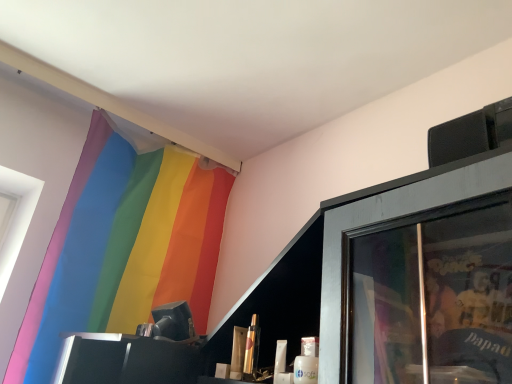
The image size is (512, 384). Find the location of `metallic gold lipstick at center, the 2th toiletry in the left-to-right sequence`. metallic gold lipstick at center, the 2th toiletry in the left-to-right sequence is located at coordinates (251, 350).

Based on their sizes in the image, would you say rainbow fabric curtain at upper left is bigger or smaller than metallic gold lipstick at center, positioned as the second toiletry in right-to-left order?

In the image, rainbow fabric curtain at upper left appears to be larger than metallic gold lipstick at center, positioned as the second toiletry in right-to-left order.

In the scene shown: Is rainbow fabric curtain at upper left completely or partially outside of metallic gold lipstick at center, positioned as the second toiletry in right-to-left order?

Yes, rainbow fabric curtain at upper left is located beyond the bounds of metallic gold lipstick at center, positioned as the second toiletry in right-to-left order.

Is rainbow fabric curtain at upper left placed right next to metallic gold lipstick at center, the 1th toiletry in the left-to-right sequence?

No, rainbow fabric curtain at upper left is not beside metallic gold lipstick at center, the 1th toiletry in the left-to-right sequence.

You are a GUI agent. You are given a task and a screenshot of the screen. Output one action in this format:
    pyautogui.click(x=<x>, y=<y>)
    Task: Click on the curtain above the metallic gold lipstick at center, positioned as the second toiletry in right-to-left order (from the image's perspective)
    The height and width of the screenshot is (384, 512).
    Given the screenshot: What is the action you would take?
    pos(124,246)

Which object is positioned more to the left, metallic gold lipstick at center, the 1th toiletry in the left-to-right sequence, or rainbow fabric curtain at upper left?

Positioned to the left is rainbow fabric curtain at upper left.

Is point (240, 353) positioned behind point (193, 188)?

No.

The image size is (512, 384). Identify the location of curtain above the metallic gold lipstick at center, positioned as the second toiletry in right-to-left order (from the image's perspective). (124, 246).

Between metallic gold lipstick at center, the 1th toiletry in the left-to-right sequence, and rainbow fabric curtain at upper left, which one has less height?

metallic gold lipstick at center, the 1th toiletry in the left-to-right sequence, is shorter.

Between metallic gold lipstick at center, the 1th toiletry in the left-to-right sequence, and metallic gold lipstick at center, marked as the 1th toiletry in a right-to-left arrangement, which one appears on the right side from the viewer's perspective?

metallic gold lipstick at center, marked as the 1th toiletry in a right-to-left arrangement, is more to the right.

Considering the relative sizes of metallic gold lipstick at center, the 1th toiletry in the left-to-right sequence, and metallic gold lipstick at center, the 2th toiletry in the left-to-right sequence, in the image provided, is metallic gold lipstick at center, the 1th toiletry in the left-to-right sequence, taller than metallic gold lipstick at center, the 2th toiletry in the left-to-right sequence,?

No.

From a real-world perspective, is metallic gold lipstick at center, positioned as the second toiletry in right-to-left order, on top of metallic gold lipstick at center, the 2th toiletry in the left-to-right sequence?

No, from a real-world perspective, metallic gold lipstick at center, positioned as the second toiletry in right-to-left order, is not over metallic gold lipstick at center, the 2th toiletry in the left-to-right sequence

Between metallic gold lipstick at center, the 1th toiletry in the left-to-right sequence, and metallic gold lipstick at center, marked as the 1th toiletry in a right-to-left arrangement, which one has smaller size?

With smaller size is metallic gold lipstick at center, marked as the 1th toiletry in a right-to-left arrangement.

Is point (245, 356) in front of point (233, 339)?

Yes.

Would you say metallic gold lipstick at center, the 2th toiletry in the left-to-right sequence, is inside or outside metallic gold lipstick at center, positioned as the second toiletry in right-to-left order?

metallic gold lipstick at center, the 2th toiletry in the left-to-right sequence, cannot be found inside metallic gold lipstick at center, positioned as the second toiletry in right-to-left order.

What's the angular difference between metallic gold lipstick at center, the 2th toiletry in the left-to-right sequence, and metallic gold lipstick at center, the 1th toiletry in the left-to-right sequence,'s facing directions?

The facing directions of metallic gold lipstick at center, the 2th toiletry in the left-to-right sequence, and metallic gold lipstick at center, the 1th toiletry in the left-to-right sequence, are 0.00106 degrees apart.

Consider the image. Between rainbow fabric curtain at upper left and metallic gold lipstick at center, the 2th toiletry in the left-to-right sequence, which one is positioned behind?

rainbow fabric curtain at upper left.

Looking at this image, considering the sizes of objects rainbow fabric curtain at upper left and metallic gold lipstick at center, marked as the 1th toiletry in a right-to-left arrangement, in the image provided, who is smaller, rainbow fabric curtain at upper left or metallic gold lipstick at center, marked as the 1th toiletry in a right-to-left arrangement,?

metallic gold lipstick at center, marked as the 1th toiletry in a right-to-left arrangement, is smaller.

Is point (99, 247) closer to viewer compared to point (250, 355)?

No, it is not.

Where is `toiletry that is the 2nd one when counting rightward from the rainbow fabric curtain at upper left`? The image size is (512, 384). toiletry that is the 2nd one when counting rightward from the rainbow fabric curtain at upper left is located at coordinates (251, 350).

Considering the positions of points (248, 378) and (83, 322), is point (248, 378) farther from camera compared to point (83, 322)?

No, (248, 378) is in front of (83, 322).

Can you confirm if metallic gold lipstick at center, marked as the 1th toiletry in a right-to-left arrangement, is taller than rainbow fabric curtain at upper left?

In fact, metallic gold lipstick at center, marked as the 1th toiletry in a right-to-left arrangement, may be shorter than rainbow fabric curtain at upper left.

Which object is closer to the camera, metallic gold lipstick at center, the 2th toiletry in the left-to-right sequence, or rainbow fabric curtain at upper left?

Positioned in front is metallic gold lipstick at center, the 2th toiletry in the left-to-right sequence.

From a real-world perspective, count 2nd toiletrys downward from the rainbow fabric curtain at upper left and point to it. Please provide its 2D coordinates.

[(238, 352)]

In order to click on curtain above the metallic gold lipstick at center, the 1th toiletry in the left-to-right sequence (from a real-world perspective) in this screenshot , I will do `click(124, 246)`.

When comparing their distances from metallic gold lipstick at center, the 2th toiletry in the left-to-right sequence, does metallic gold lipstick at center, positioned as the second toiletry in right-to-left order, or rainbow fabric curtain at upper left seem closer?

metallic gold lipstick at center, positioned as the second toiletry in right-to-left order.

Looking at the image, which one is located further to rainbow fabric curtain at upper left, metallic gold lipstick at center, positioned as the second toiletry in right-to-left order, or metallic gold lipstick at center, the 2th toiletry in the left-to-right sequence?

metallic gold lipstick at center, the 2th toiletry in the left-to-right sequence, is further to rainbow fabric curtain at upper left.

From the image, which object appears to be farther from metallic gold lipstick at center, the 2th toiletry in the left-to-right sequence, rainbow fabric curtain at upper left or metallic gold lipstick at center, the 1th toiletry in the left-to-right sequence?

rainbow fabric curtain at upper left is positioned further to the anchor metallic gold lipstick at center, the 2th toiletry in the left-to-right sequence.

Estimate the real-world distances between objects in this image. Which object is further from metallic gold lipstick at center, positioned as the second toiletry in right-to-left order, metallic gold lipstick at center, the 2th toiletry in the left-to-right sequence, or rainbow fabric curtain at upper left?

rainbow fabric curtain at upper left is positioned further to the anchor metallic gold lipstick at center, positioned as the second toiletry in right-to-left order.

Based on their spatial positions, is rainbow fabric curtain at upper left or metallic gold lipstick at center, the 2th toiletry in the left-to-right sequence, further from metallic gold lipstick at center, the 1th toiletry in the left-to-right sequence?

rainbow fabric curtain at upper left is further to metallic gold lipstick at center, the 1th toiletry in the left-to-right sequence.

From the picture: When comparing their distances from rainbow fabric curtain at upper left, does metallic gold lipstick at center, marked as the 1th toiletry in a right-to-left arrangement, or metallic gold lipstick at center, the 1th toiletry in the left-to-right sequence, seem further?

Based on the image, metallic gold lipstick at center, marked as the 1th toiletry in a right-to-left arrangement, appears to be further to rainbow fabric curtain at upper left.

The height and width of the screenshot is (384, 512). In order to click on toiletry between rainbow fabric curtain at upper left and metallic gold lipstick at center, the 2th toiletry in the left-to-right sequence, in the horizontal direction in this screenshot , I will do `click(238, 352)`.